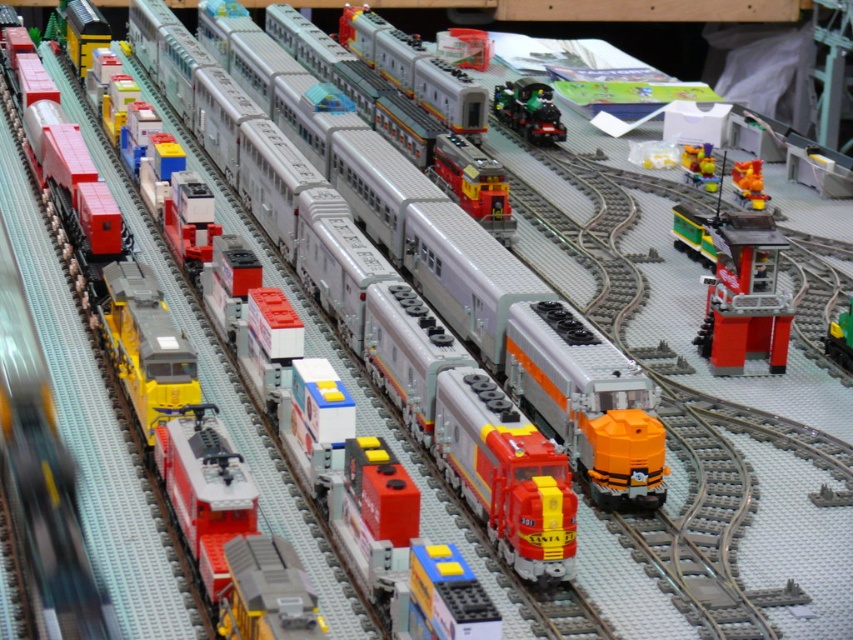
Between shiny green metal train at upper right and translucent yellow toy at center, which one has less height?

translucent yellow toy at center

Consider the image. Does shiny green metal train at upper right appear over translucent yellow toy at center?

Yes.

Which is in front, point (537, 102) or point (682, 150)?

Positioned in front is point (682, 150).

At what (x,y) coordinates should I click in order to perform the action: click on shiny green metal train at upper right. Please return your answer as a coordinate pair (x, y). The width and height of the screenshot is (853, 640). Looking at the image, I should click on (527, 109).

Is matte plastic train at center to the left of translucent yellow toy at center from the viewer's perspective?

Correct, you'll find matte plastic train at center to the left of translucent yellow toy at center.

Is matte plastic train at center to the right of translucent yellow toy at center from the viewer's perspective?

In fact, matte plastic train at center is to the left of translucent yellow toy at center.

Is point (653, 486) closer to viewer compared to point (712, 172)?

Yes.

The image size is (853, 640). Identify the location of matte plastic train at center. (521, 333).

Image resolution: width=853 pixels, height=640 pixels. Describe the element at coordinates (527, 109) in the screenshot. I see `shiny green metal train at upper right` at that location.

Is shiny green metal train at upper right closer to the viewer compared to green plastic toy at center?

No, it is behind green plastic toy at center.

Does point (494, 90) come farther from viewer compared to point (850, 346)?

Yes, it is behind point (850, 346).

Image resolution: width=853 pixels, height=640 pixels. Find the location of `shiny green metal train at upper right`. shiny green metal train at upper right is located at coordinates pyautogui.click(x=527, y=109).